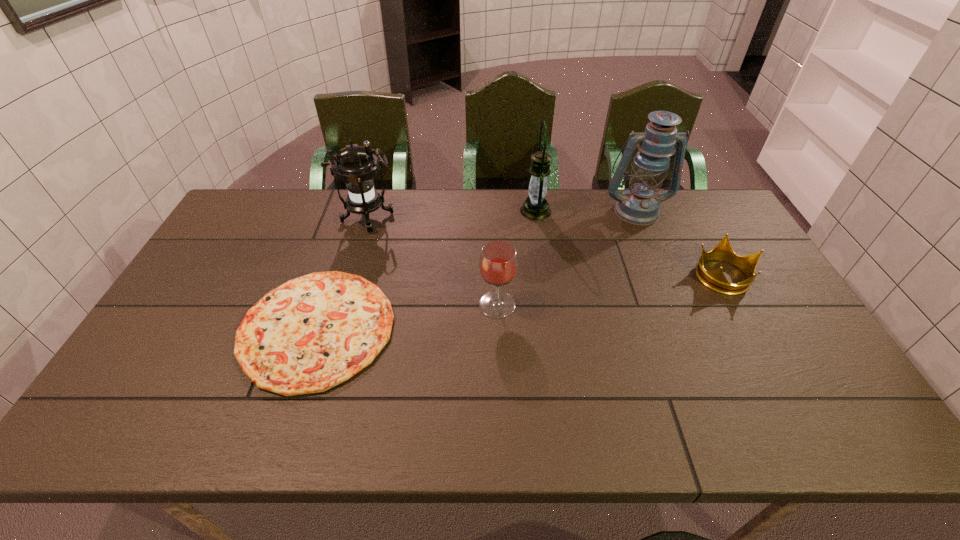
The height and width of the screenshot is (540, 960). I want to click on the fifth closest object relative to the third object from right to left, so coord(312,333).

Point out which lantern is positioned as the second nearest to the second shortest object. Please provide its 2D coordinates. Your answer should be formatted as a tuple, i.e. [(x, y)], where the tuple contains the x and y coordinates of a point satisfying the conditions above.

[(535, 207)]

Identify which lantern is the closest to the rightmost lantern. Please provide its 2D coordinates. Your answer should be formatted as a tuple, i.e. [(x, y)], where the tuple contains the x and y coordinates of a point satisfying the conditions above.

[(535, 207)]

The height and width of the screenshot is (540, 960). I want to click on free location that satisfies the following two spatial constraints: 1. on the front-facing side of the crown; 2. on the left side of the rightmost lantern, so (x=663, y=275).

Where is `free space that satisfies the following two spatial constraints: 1. on the side where the crown emits light; 2. on the right side of the third object from right to left`? free space that satisfies the following two spatial constraints: 1. on the side where the crown emits light; 2. on the right side of the third object from right to left is located at coordinates (545, 275).

The height and width of the screenshot is (540, 960). Identify the location of vacant region that satisfies the following two spatial constraints: 1. on the front side of the leftmost lantern; 2. on the left side of the fifth tallest object. (351, 275).